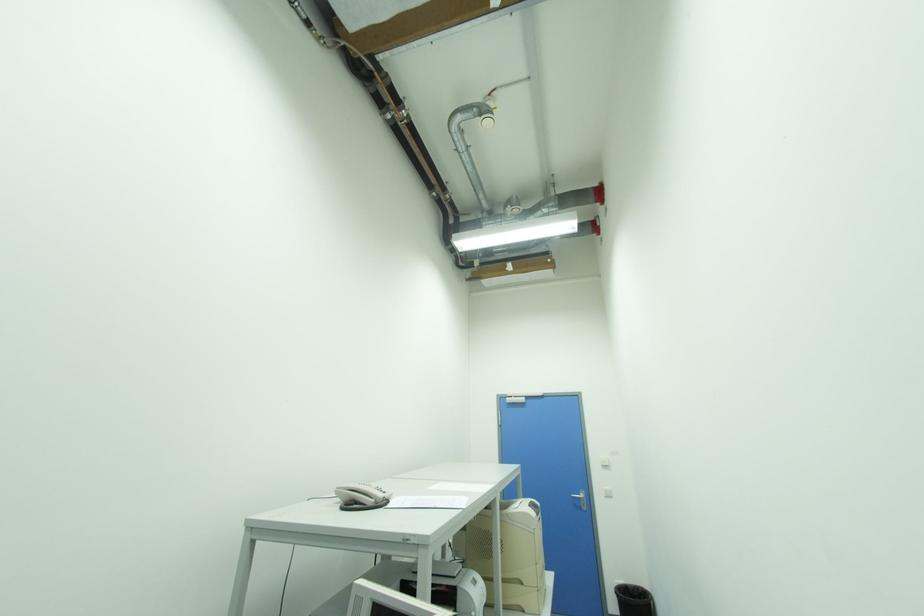
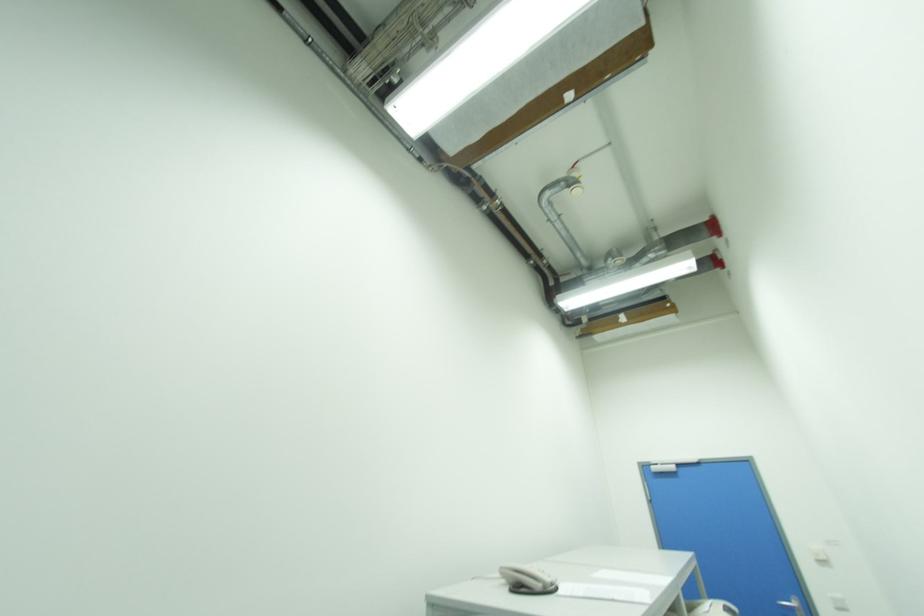
Which direction would the cameraman need to move to produce the second image?

The cameraman moved toward left, backward.